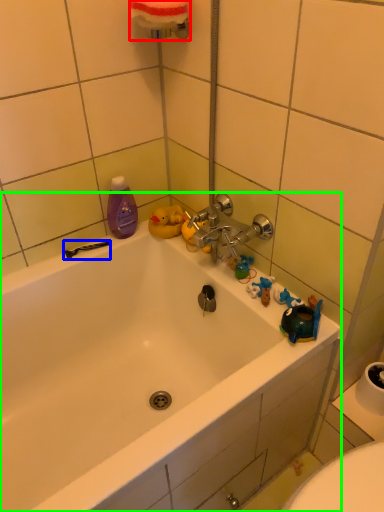
Question: Which is farther away from towel bar (highlighted by a red box)? shower (highlighted by a blue box) or bathtub (highlighted by a green box)?

Choices:
 (A) shower
 (B) bathtub

Answer: (B)